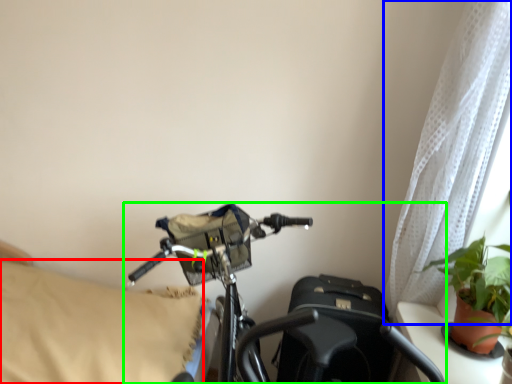
Question: Which is nearer to the pillow (highlighted by a red box)? curtain (highlighted by a blue box) or bicycle (highlighted by a green box).

Choices:
 (A) curtain
 (B) bicycle

Answer: (B)